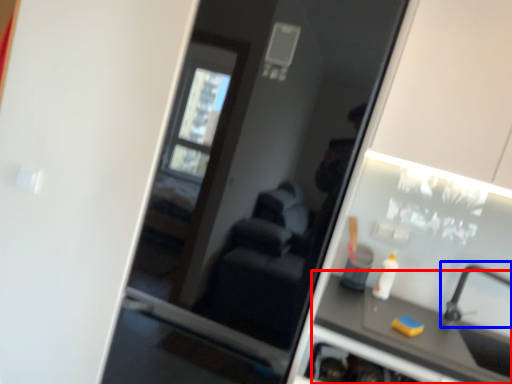
Question: Which of the following is the closest to the observer, counter top (highlighted by a red box) or faucet (highlighted by a blue box)?

Choices:
 (A) counter top
 (B) faucet

Answer: (A)